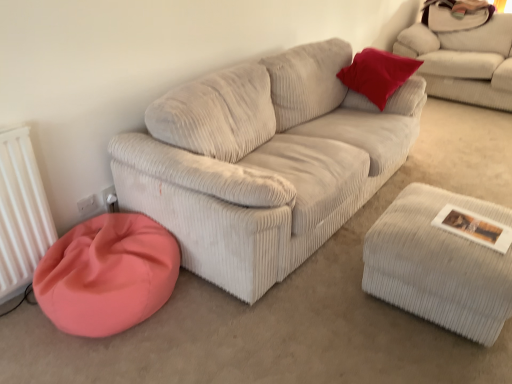
Question: From a real-world perspective, is white corduroy stool at lower right beneath coral fabric bean bag at lower left?

Choices:
 (A) no
 (B) yes

Answer: (A)

Question: Does white corduroy stool at lower right lie behind coral fabric bean bag at lower left?

Choices:
 (A) no
 (B) yes

Answer: (A)

Question: Does white corduroy stool at lower right have a greater height compared to coral fabric bean bag at lower left?

Choices:
 (A) no
 (B) yes

Answer: (B)

Question: Considering the relative positions of white corduroy stool at lower right and coral fabric bean bag at lower left in the image provided, is white corduroy stool at lower right in front of coral fabric bean bag at lower left?

Choices:
 (A) yes
 (B) no

Answer: (A)

Question: Is white corduroy stool at lower right to the right of coral fabric bean bag at lower left from the viewer's perspective?

Choices:
 (A) yes
 (B) no

Answer: (A)

Question: Could you tell me if white corduroy stool at lower right is facing coral fabric bean bag at lower left?

Choices:
 (A) no
 (B) yes

Answer: (A)

Question: Is white corduroy couch at upper right positioned beyond the bounds of white corduroy stool at lower right?

Choices:
 (A) yes
 (B) no

Answer: (A)

Question: Could you tell me if white corduroy couch at upper right is facing white corduroy stool at lower right?

Choices:
 (A) no
 (B) yes

Answer: (B)

Question: Is white corduroy couch at upper right looking in the opposite direction of white corduroy stool at lower right?

Choices:
 (A) yes
 (B) no

Answer: (B)

Question: Is white corduroy couch at upper right far from white corduroy stool at lower right?

Choices:
 (A) yes
 (B) no

Answer: (A)

Question: Is white corduroy couch at upper right smaller than white corduroy stool at lower right?

Choices:
 (A) no
 (B) yes

Answer: (A)

Question: Is white corduroy couch at upper right positioned in front of white corduroy stool at lower right?

Choices:
 (A) no
 (B) yes

Answer: (A)

Question: Does white corduroy couch at upper right lie behind coral fabric bean bag at lower left?

Choices:
 (A) yes
 (B) no

Answer: (A)